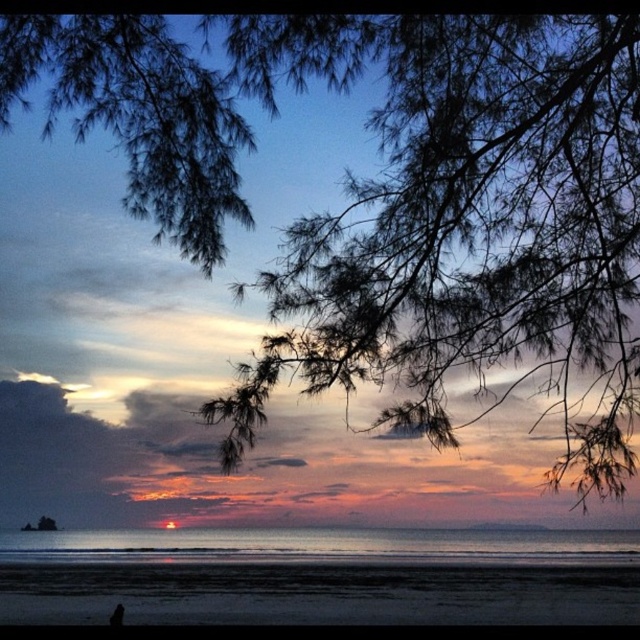
Is point (275, 586) less distant than point (109, 620)?

No, it is behind (109, 620).

Which is above, sandy beach at lower center or black matte person at lower left?

black matte person at lower left is higher up.

Identify the location of sandy beach at lower center. (317, 593).

Where is `sandy beach at lower center`? This screenshot has width=640, height=640. sandy beach at lower center is located at coordinates (317, 593).